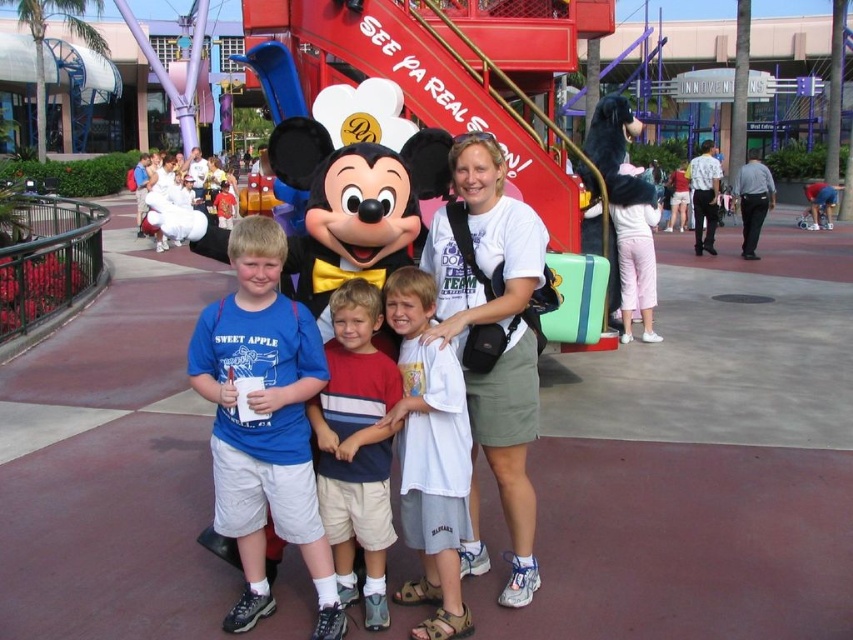
This screenshot has width=853, height=640. What do you see at coordinates (358, 168) in the screenshot?
I see `matte black costume at center` at bounding box center [358, 168].

In order to click on matte black costume at center in this screenshot , I will do `click(358, 168)`.

You are a GUI agent. You are given a task and a screenshot of the screen. Output one action in this format:
    pyautogui.click(x=<x>, y=<y>)
    Task: Click on the matte black costume at center
    
    Given the screenshot: What is the action you would take?
    pyautogui.click(x=358, y=168)

Does blue cotton shirt at center appear over matte black costume at center?

No.

From the picture: Which is above, blue cotton shirt at center or matte black costume at center?

Positioned higher is matte black costume at center.

Image resolution: width=853 pixels, height=640 pixels. In order to click on blue cotton shirt at center in this screenshot , I will do 263,420.

Locate an element on the screen. This screenshot has width=853, height=640. blue cotton shirt at center is located at coordinates (263, 420).

Does blue cotton shirt at center come in front of white plush bear at upper left?

That is True.

Does point (306, 524) lie behind point (155, 198)?

That is False.

Between point (289, 506) and point (164, 225), which one is positioned in front?

Point (289, 506) is in front.

This screenshot has width=853, height=640. Find the location of `blue cotton shirt at center`. blue cotton shirt at center is located at coordinates (263, 420).